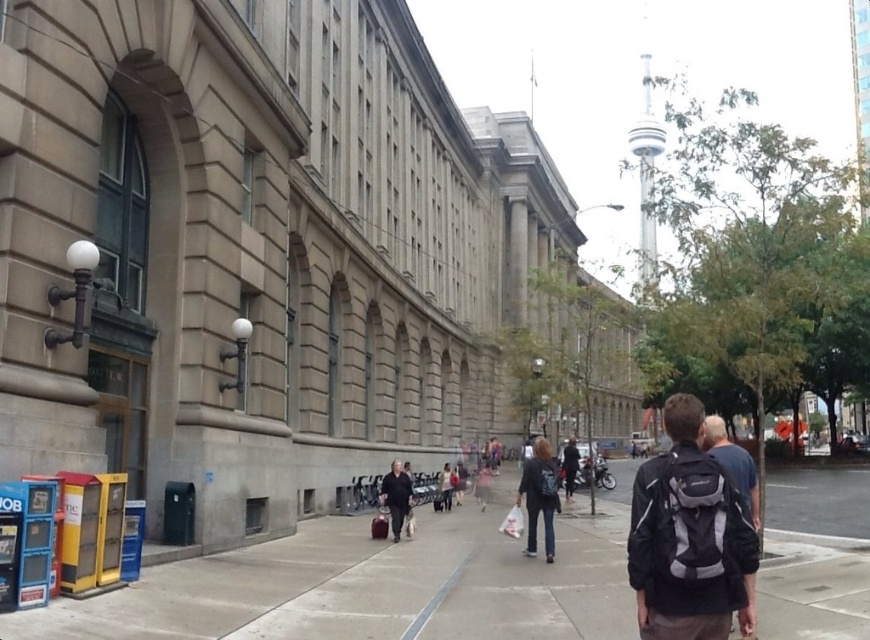
Does dark blue backpack at center have a lesser width compared to dark gray fabric jacket at center?

In fact, dark blue backpack at center might be wider than dark gray fabric jacket at center.

Is point (748, 458) behind point (400, 492)?

No, (748, 458) is closer to viewer.

The image size is (870, 640). I want to click on dark blue backpack at center, so coord(733,464).

Does point (693, 600) come behind point (392, 492)?

That is False.

Does matte black backpack at center have a larger size compared to dark gray fabric jacket at center?

Indeed, matte black backpack at center has a larger size compared to dark gray fabric jacket at center.

Identify the location of matte black backpack at center. This screenshot has height=640, width=870. (688, 538).

Can you confirm if gray concrete sidewalk at center is smaller than dark gray fabric jacket at center?

Actually, gray concrete sidewalk at center might be larger than dark gray fabric jacket at center.

Is gray concrete sidewalk at center to the right of dark gray fabric jacket at center from the viewer's perspective?

Yes, gray concrete sidewalk at center is to the right of dark gray fabric jacket at center.

Does point (771, 547) come in front of point (392, 484)?

Yes, it is in front of point (392, 484).

Identify the location of gray concrete sidewalk at center. This screenshot has height=640, width=870. (370, 588).